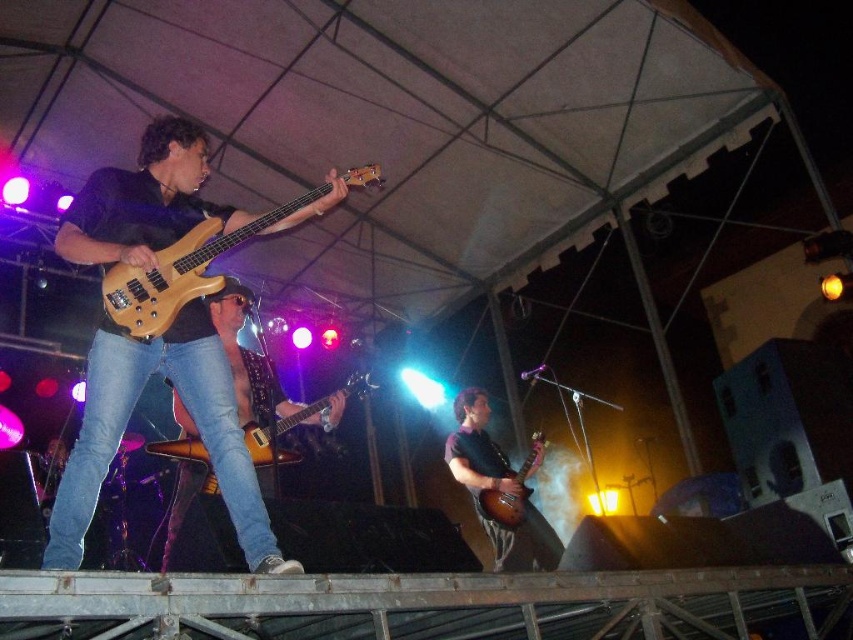
Question: Among these objects, which one is nearest to the camera?

Choices:
 (A) glossy wood guitar at upper left
 (B) glossy wood guitar at center

Answer: (A)

Question: Is glossy wood guitar at upper left thinner than wooden electric guitar at center?

Choices:
 (A) yes
 (B) no

Answer: (B)

Question: Estimate the real-world distances between objects in this image. Which object is closer to the matte wood bass guitar at left?

Choices:
 (A) glossy wood guitar at center
 (B) glossy wood guitar at upper left

Answer: (B)

Question: Is matte wood bass guitar at left below glossy wood guitar at center?

Choices:
 (A) yes
 (B) no

Answer: (B)

Question: Is the position of matte wood bass guitar at left more distant than that of glossy wood guitar at upper left?

Choices:
 (A) yes
 (B) no

Answer: (B)

Question: Which of the following is the farthest from the observer?

Choices:
 (A) glossy wood guitar at center
 (B) matte wood bass guitar at left
 (C) wooden electric guitar at center
 (D) glossy wood guitar at upper left

Answer: (C)